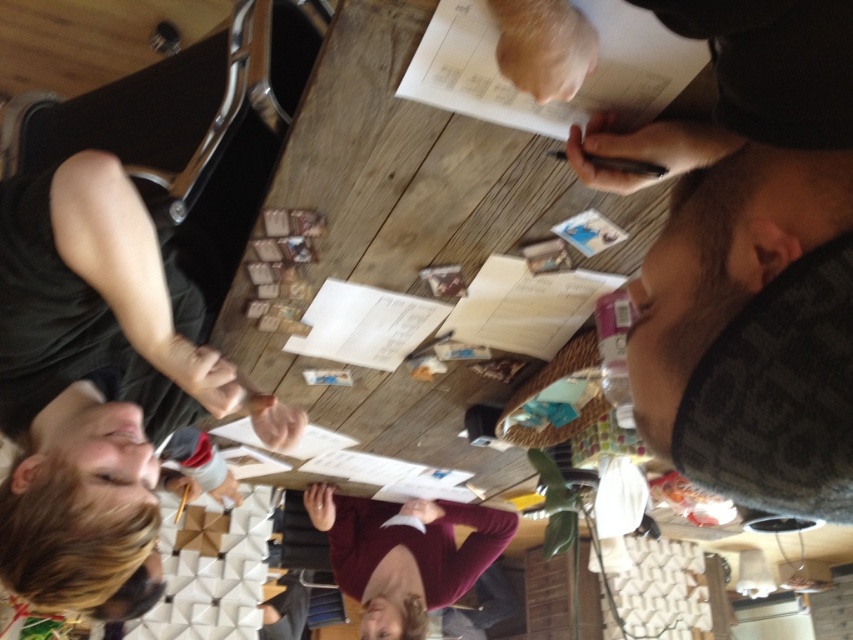
Who is lower down, white paper at upper center or maroon sweater at center?

maroon sweater at center is below.

Can you confirm if white paper at upper center is positioned to the right of maroon sweater at center?

Correct, you'll find white paper at upper center to the right of maroon sweater at center.

Is point (456, 80) farther from viewer compared to point (485, 508)?

No, (456, 80) is closer to viewer.

Where is `white paper at upper center`? white paper at upper center is located at coordinates (552, 100).

Is dark gray textured shirt at upper right thinner than maroon sweater at center?

Yes, dark gray textured shirt at upper right is thinner than maroon sweater at center.

Where is `dark gray textured shirt at upper right`? dark gray textured shirt at upper right is located at coordinates (750, 259).

Does dark gray textured shirt at upper right appear over white paper at upper center?

Actually, dark gray textured shirt at upper right is below white paper at upper center.

Where is `dark gray textured shirt at upper right`? dark gray textured shirt at upper right is located at coordinates (750, 259).